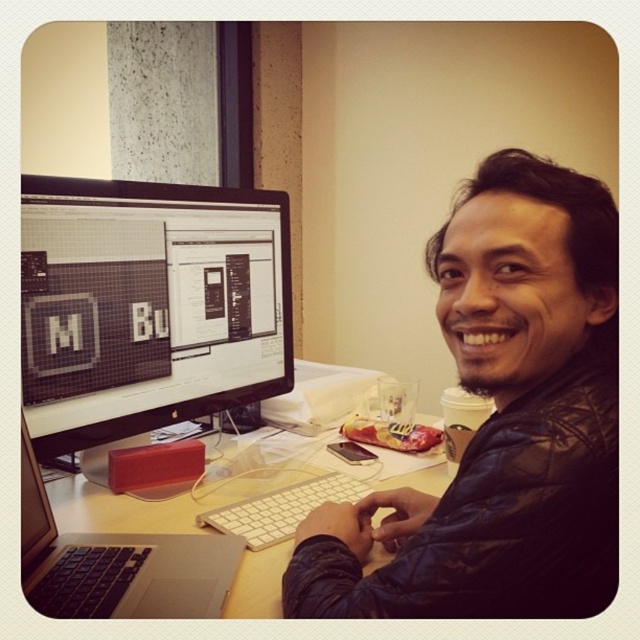
Question: Does leather jacket at center have a lesser width compared to silver metallic laptop at lower left?

Choices:
 (A) yes
 (B) no

Answer: (B)

Question: Can you confirm if leather jacket at center is wider than white plastic keyboard at center?

Choices:
 (A) no
 (B) yes

Answer: (B)

Question: Which point appears farthest from the camera in this image?

Choices:
 (A) (214, 561)
 (B) (232, 532)
 (C) (600, 435)
 (D) (244, 314)

Answer: (D)

Question: Which of these objects is positioned closest to the silver metallic laptop at lower left?

Choices:
 (A) leather jacket at center
 (B) white plastic keyboard at center
 (C) black glossy monitor at upper left
 (D) white plastic computer desk at center

Answer: (B)

Question: Is leather jacket at center to the left of white plastic keyboard at center from the viewer's perspective?

Choices:
 (A) yes
 (B) no

Answer: (B)

Question: Estimate the real-world distances between objects in this image. Which object is farther from the leather jacket at center?

Choices:
 (A) silver metallic laptop at lower left
 (B) white plastic keyboard at center
 (C) black glossy monitor at upper left

Answer: (C)